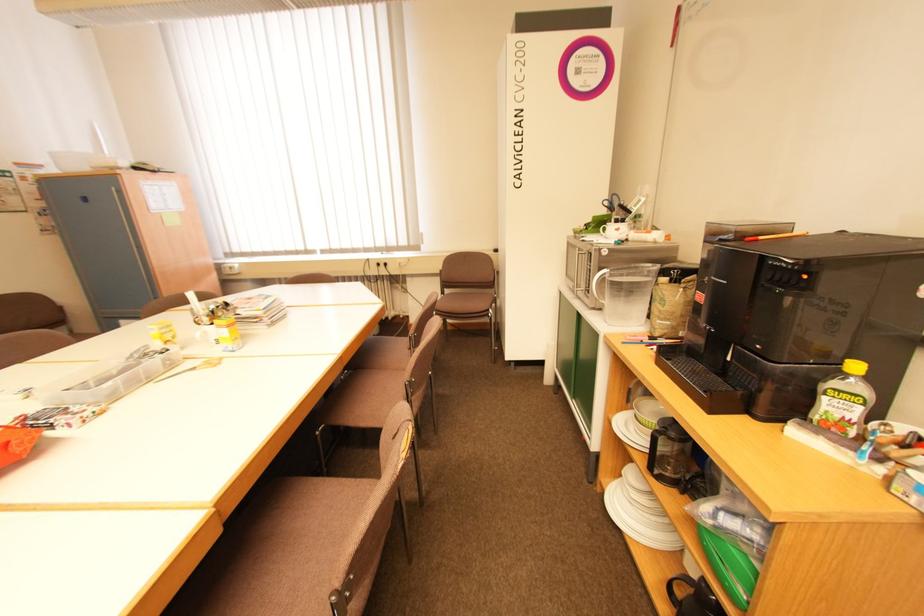
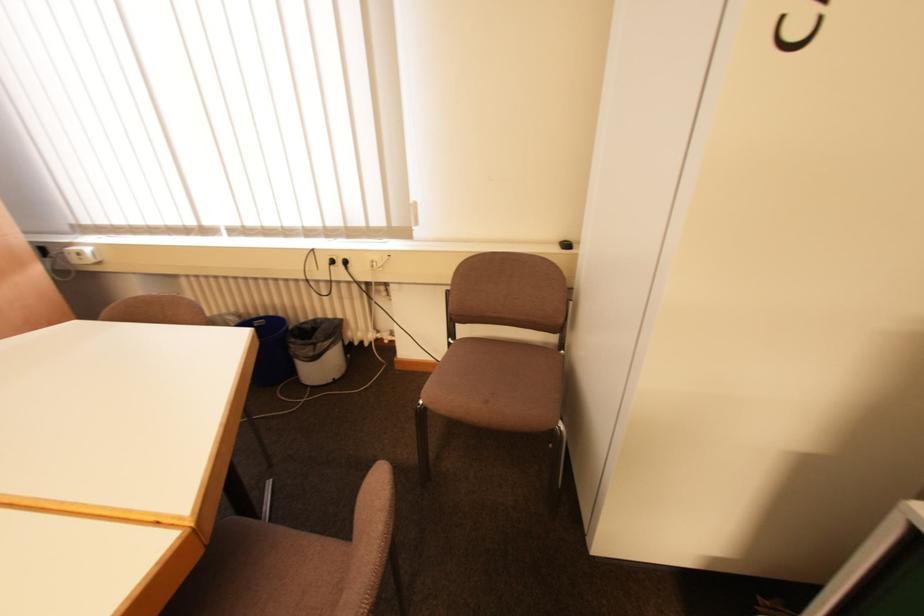
Question: Which direction would the cameraman need to move to produce the second image? Reply with the corresponding letter.

Choices:
 (A) Left
 (B) Right
 (C) Forward
 (D) Backward

Answer: (C)